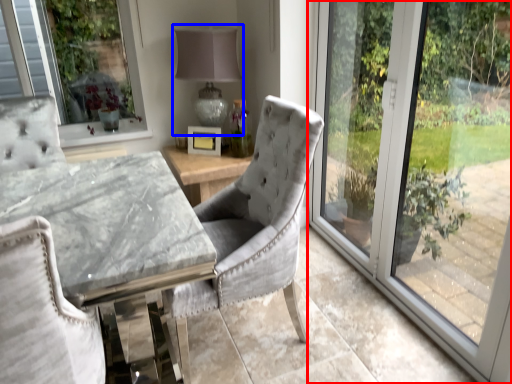
Question: Among these objects, which one is nearest to the camera, window (highlighted by a red box) or table lamp (highlighted by a blue box)?

Choices:
 (A) window
 (B) table lamp

Answer: (A)